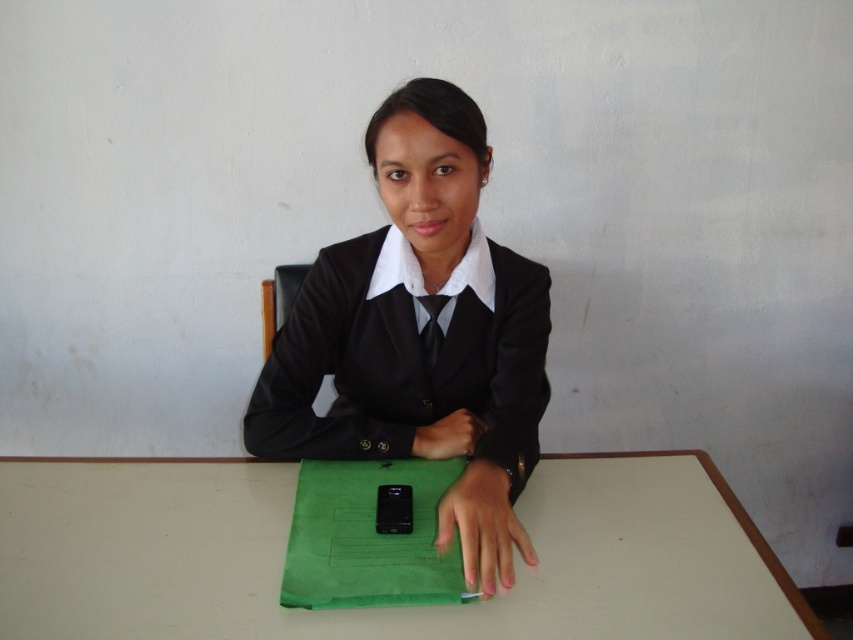
You are a photographer setting up a portrait session. You notice two hands in the frame, a smooth skin hand at center and a matte black hand at center. Which hand should you focus on to ensure it appears sharper in the final photo?

The smooth skin hand at center is closer to the viewer, so focusing on it will make it appear sharper in the final photo.

Based on the photo, you are a photographer setting up a lighting setup for a portrait. You notice two hands on the desk in front of the subject. The smooth skin hand at center and the matte black hand at center. Which hand should you position closer to the light source to avoid harsh shadows?

The smooth skin hand at center is much taller than the matte black hand at center, so positioning the smooth skin hand at center closer to the light source will help avoid harsh shadows due to its height advantage.

You are a tailor measuring a client for a custom suit. The client is sitting at the white matte table at center wearing the black matte uniform at center. Which item is closer to the floor?

The white matte table at center is shorter than the black matte uniform at center, so the table is closer to the floor than the uniform.